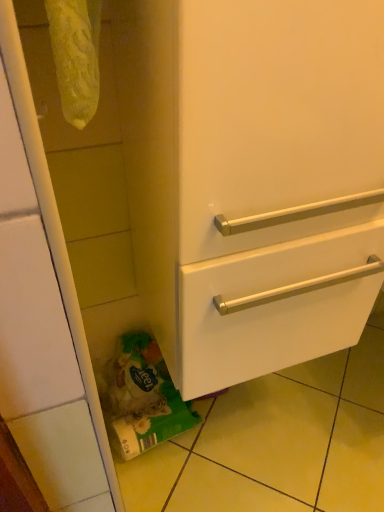
Image resolution: width=384 pixels, height=512 pixels. What do you see at coordinates (276, 183) in the screenshot? I see `white glossy drawer at lower right` at bounding box center [276, 183].

Locate an element on the screen. Image resolution: width=384 pixels, height=512 pixels. white glossy drawer at lower right is located at coordinates (276, 183).

From the picture: Measure the distance between point (269, 286) and camera.

The depth of point (269, 286) is 26.34 inches.

The height and width of the screenshot is (512, 384). Describe the element at coordinates (141, 397) in the screenshot. I see `green matte plastic bag at lower left` at that location.

You are a GUI agent. You are given a task and a screenshot of the screen. Output one action in this format:
    pyautogui.click(x=<x>, y=<y>)
    Task: Click on the green matte plastic bag at lower left
    
    Given the screenshot: What is the action you would take?
    pyautogui.click(x=141, y=397)

Where is `white glossy drawer at lower right`? white glossy drawer at lower right is located at coordinates (276, 183).

Does green matte plastic bag at lower left appear on the left side of white glossy drawer at lower right?

Correct, you'll find green matte plastic bag at lower left to the left of white glossy drawer at lower right.

In the image, is green matte plastic bag at lower left positioned in front of or behind white glossy drawer at lower right?

green matte plastic bag at lower left is behind white glossy drawer at lower right.

Is point (173, 385) positioned behind point (325, 320)?

Yes, it is behind point (325, 320).

From the image's perspective, which one is positioned lower, green matte plastic bag at lower left or white glossy drawer at lower right?

From the image's view, green matte plastic bag at lower left is below.

From a real-world perspective, who is located higher, green matte plastic bag at lower left or white glossy drawer at lower right?

white glossy drawer at lower right is physically above.

Between green matte plastic bag at lower left and white glossy drawer at lower right, which one has larger width?

white glossy drawer at lower right.

Is green matte plastic bag at lower left shorter than white glossy drawer at lower right?

Indeed, green matte plastic bag at lower left has a lesser height compared to white glossy drawer at lower right.

In the scene shown: In terms of size, does green matte plastic bag at lower left appear bigger or smaller than white glossy drawer at lower right?

In the image, green matte plastic bag at lower left appears to be smaller than white glossy drawer at lower right.

Is green matte plastic bag at lower left surrounding white glossy drawer at lower right?

No, white glossy drawer at lower right is not a part of green matte plastic bag at lower left.

Is there a large distance between green matte plastic bag at lower left and white glossy drawer at lower right?

green matte plastic bag at lower left is actually quite close to white glossy drawer at lower right.

Is green matte plastic bag at lower left looking in the opposite direction of white glossy drawer at lower right?

green matte plastic bag at lower left does not have its back to white glossy drawer at lower right.

How different are the orientations of green matte plastic bag at lower left and white glossy drawer at lower right in degrees?

10.4 degrees.

You are a GUI agent. You are given a task and a screenshot of the screen. Output one action in this format:
    pyautogui.click(x=<x>, y=<y>)
    Task: Click on the garbage below the white glossy drawer at lower right (from a real-world perspective)
    The height and width of the screenshot is (512, 384).
    Given the screenshot: What is the action you would take?
    pyautogui.click(x=141, y=397)

Between white glossy drawer at lower right and green matte plastic bag at lower left, which one appears on the right side from the viewer's perspective?

white glossy drawer at lower right.

Is white glossy drawer at lower right behind green matte plastic bag at lower left?

No, it is not.

Considering the points (198, 393) and (114, 429), which point is in front, point (198, 393) or point (114, 429)?

The point (198, 393) is more forward.

From the image's perspective, is white glossy drawer at lower right below green matte plastic bag at lower left?

No.

From a real-world perspective, who is located higher, white glossy drawer at lower right or green matte plastic bag at lower left?

white glossy drawer at lower right, from a real-world perspective.

Which of these two, white glossy drawer at lower right or green matte plastic bag at lower left, is thinner?

green matte plastic bag at lower left.

Considering the sizes of objects white glossy drawer at lower right and green matte plastic bag at lower left in the image provided, who is taller, white glossy drawer at lower right or green matte plastic bag at lower left?

white glossy drawer at lower right is taller.

Between white glossy drawer at lower right and green matte plastic bag at lower left, which one has smaller size?

With smaller size is green matte plastic bag at lower left.

Based on the photo, do you think white glossy drawer at lower right is within green matte plastic bag at lower left, or outside of it?

white glossy drawer at lower right lies outside green matte plastic bag at lower left.

Are white glossy drawer at lower right and green matte plastic bag at lower left far apart?

No, white glossy drawer at lower right is in close proximity to green matte plastic bag at lower left.

Could you tell me if white glossy drawer at lower right is turned towards green matte plastic bag at lower left?

No, white glossy drawer at lower right is not aimed at green matte plastic bag at lower left.

Based on the photo, how different are the orientations of white glossy drawer at lower right and green matte plastic bag at lower left in degrees?

The facing directions of white glossy drawer at lower right and green matte plastic bag at lower left are 10.4 degrees apart.

In order to click on door on the right side of green matte plastic bag at lower left in this screenshot , I will do `click(276, 183)`.

The height and width of the screenshot is (512, 384). I want to click on garbage lying on the left of white glossy drawer at lower right, so click(x=141, y=397).

You are a GUI agent. You are given a task and a screenshot of the screen. Output one action in this format:
    pyautogui.click(x=<x>, y=<y>)
    Task: Click on the door in front of the green matte plastic bag at lower left
    
    Given the screenshot: What is the action you would take?
    pyautogui.click(x=276, y=183)